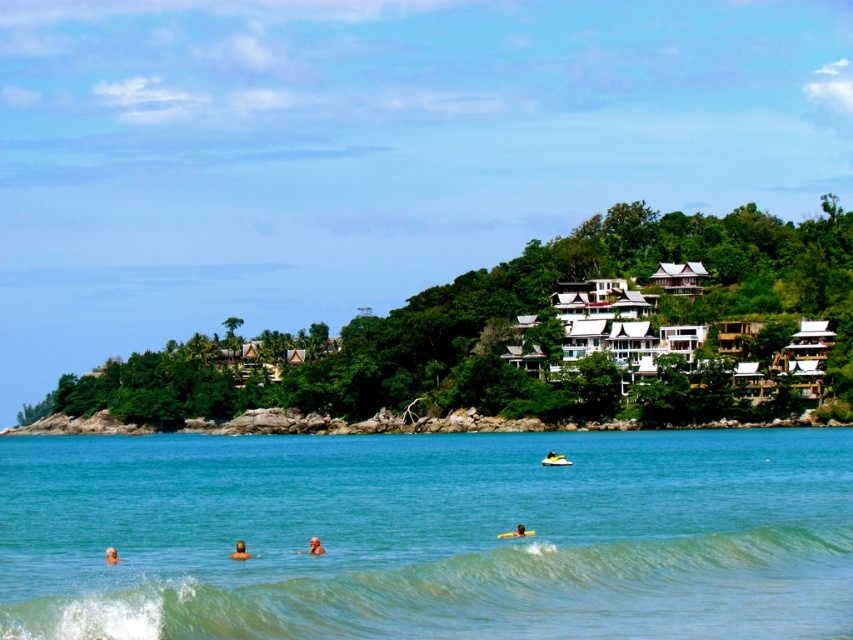
You are a photographer standing on the beach and want to take a photo of the brown skin at lower center and the brown textured surfboard at center. Which object will appear larger in the photo?

The brown skin at lower center will appear larger in the photo because it is closer to the viewer than the brown textured surfboard at center.

You are standing at the camera position and want to take a photo of the brown skin at lower center. Considering the distance, will the subject be in focus if your camera has an auto focus range up to 200 feet?

The distance between the brown skin at lower center and the camera is 232.82 feet, which exceeds the camera auto focus range of 200 feet. Therefore, the subject will not be in focus automatically.